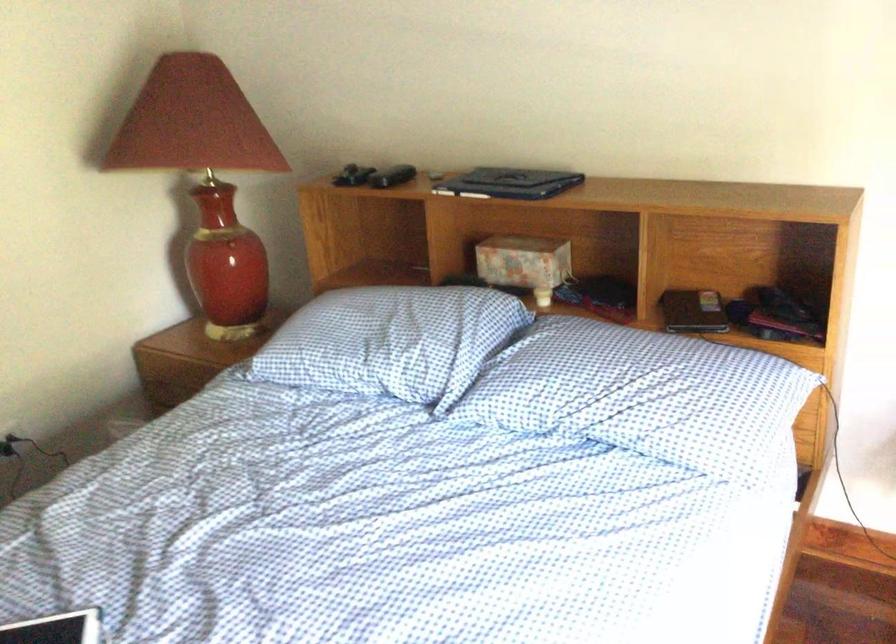
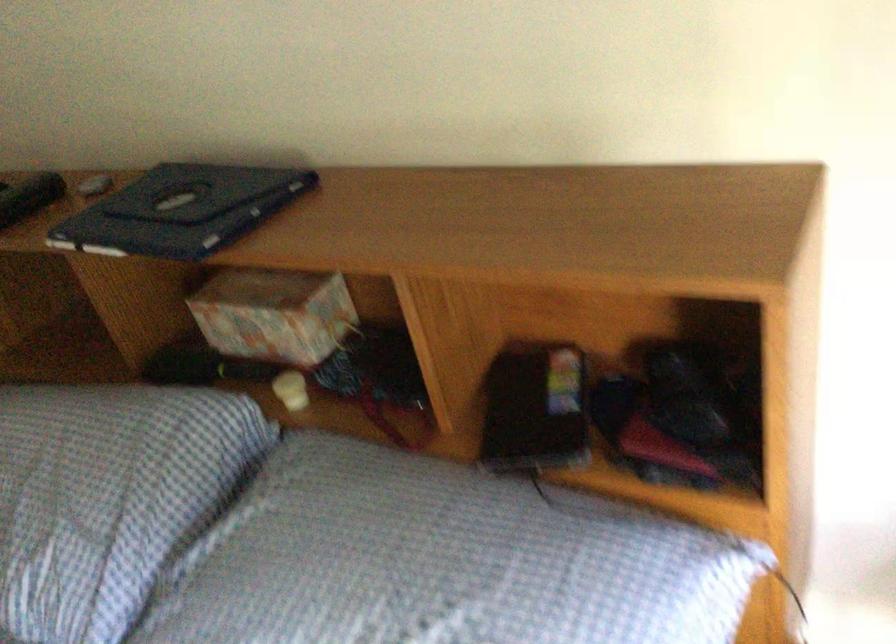
The images are taken continuously from a first-person perspective. In which direction are you moving?

The movement direction of the cameraman is right, forward.